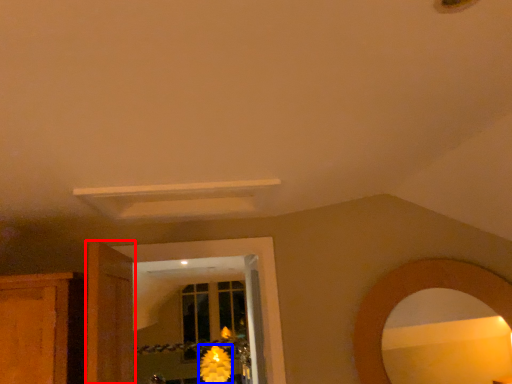
Question: Which object appears closest to the camera in this image, door (highlighted by a red box) or flower (highlighted by a blue box)?

Choices:
 (A) door
 (B) flower

Answer: (A)